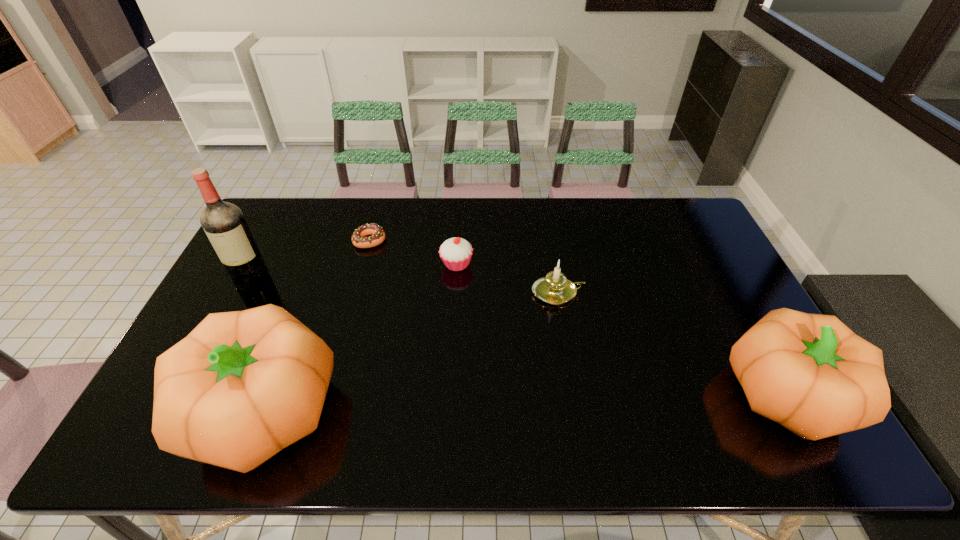
I want to click on the taller pumpkin, so click(x=243, y=385).

The width and height of the screenshot is (960, 540). Identify the location of the left pumpkin. (243, 385).

Locate an element on the screen. the shorter pumpkin is located at coordinates (810, 373).

I want to click on the third tallest object, so click(x=810, y=373).

Identify the location of the third shortest object. (555, 289).

This screenshot has width=960, height=540. I want to click on candle holder, so click(x=555, y=289).

Locate an element on the screen. The width and height of the screenshot is (960, 540). doughnut is located at coordinates (359, 240).

At what (x,y) coordinates should I click in order to perform the action: click on the farthest object. Please return your answer as a coordinate pair (x, y). Looking at the image, I should click on (359, 240).

At what (x,y) coordinates should I click in order to perform the action: click on the tallest object. Please return your answer as a coordinate pair (x, y). Looking at the image, I should click on (224, 224).

Locate an element on the screen. This screenshot has height=540, width=960. cupcake is located at coordinates (456, 253).